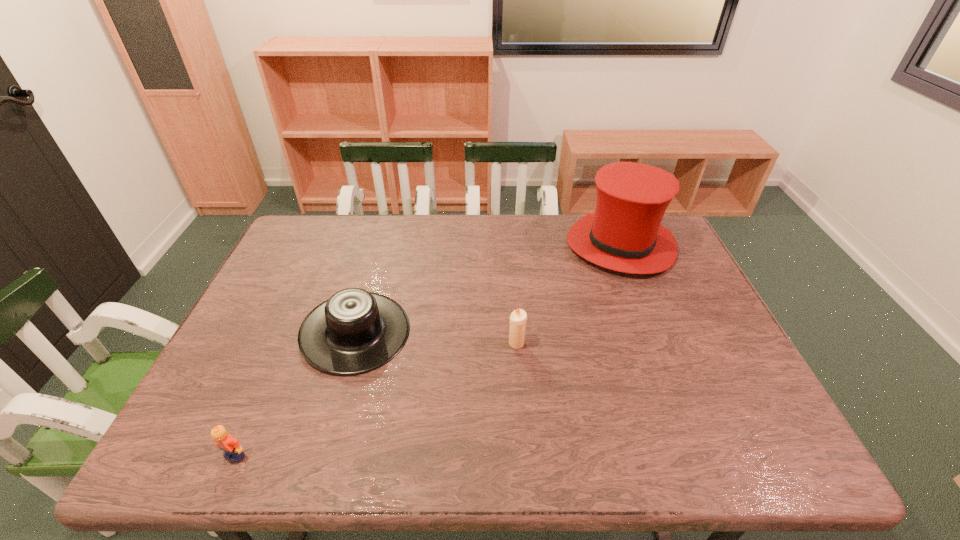
Identify the location of vacant space at the near right corner of the desktop. This screenshot has height=540, width=960. (754, 451).

Where is `vacant space that's between the farther dress hat and the second object from right to left`? Image resolution: width=960 pixels, height=540 pixels. vacant space that's between the farther dress hat and the second object from right to left is located at coordinates (568, 294).

Image resolution: width=960 pixels, height=540 pixels. I want to click on free point between the Lego and the third object from left to right, so click(375, 399).

At what (x,y) coordinates should I click in order to perform the action: click on blank region between the leftmost object and the candle. Please return your answer as a coordinate pair (x, y). Looking at the image, I should click on (375, 399).

Where is `blank region between the farthest object and the Lego`? The height and width of the screenshot is (540, 960). blank region between the farthest object and the Lego is located at coordinates pyautogui.click(x=428, y=350).

This screenshot has height=540, width=960. I want to click on free spot between the nearest object and the candle, so click(375, 399).

I want to click on free point between the Lego and the taller dress hat, so click(428, 350).

Locate an element on the screen. This screenshot has height=540, width=960. vacant point located between the second object from right to left and the right dress hat is located at coordinates (568, 294).

Locate an element on the screen. The height and width of the screenshot is (540, 960). free space between the nearest object and the second object from left to right is located at coordinates (296, 394).

Locate an element on the screen. This screenshot has width=960, height=540. vacant space that's between the candle and the left dress hat is located at coordinates (436, 338).